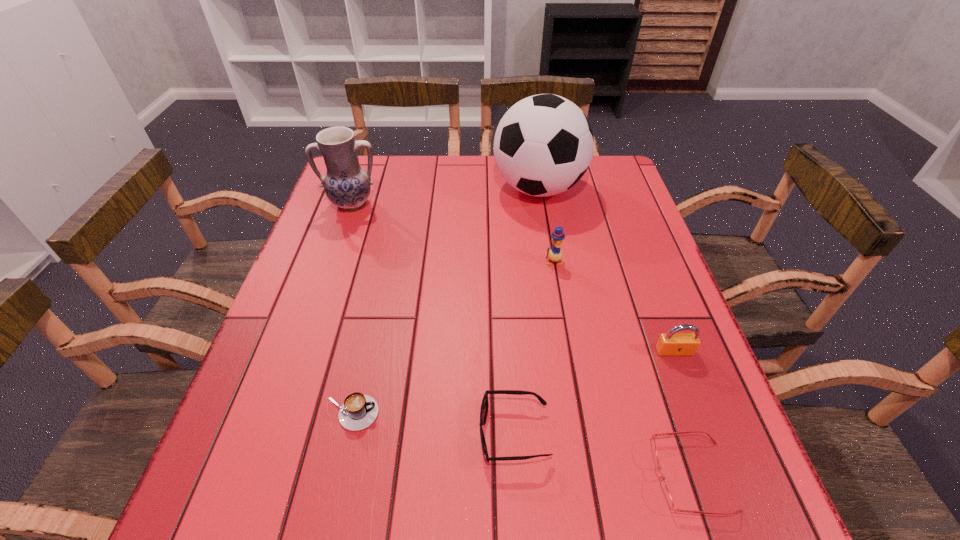
I want to click on vacant region located 0.220m on the right of the pottery, so click(x=458, y=205).

Where is `vacant space located on the face of the fifth nearest object, where the monocle is placed`? vacant space located on the face of the fifth nearest object, where the monocle is placed is located at coordinates (568, 350).

Where is `vacant space located to unlock the fourth shortest object from the front`? The width and height of the screenshot is (960, 540). vacant space located to unlock the fourth shortest object from the front is located at coordinates (739, 523).

Where is `blank space located on the front-facing side of the sunglasses`? blank space located on the front-facing side of the sunglasses is located at coordinates (350, 434).

Identify the location of vacant space located 0.340m on the front-facing side of the sunglasses. Image resolution: width=960 pixels, height=540 pixels. (288, 434).

Where is `vacant position located 0.150m on the front-facing side of the sunglasses`? The width and height of the screenshot is (960, 540). vacant position located 0.150m on the front-facing side of the sunglasses is located at coordinates (396, 434).

You are a GUI agent. You are given a task and a screenshot of the screen. Output one action in this format:
    pyautogui.click(x=<x>, y=<y>)
    Task: Click on the free space located 0.320m with the handle on the side of the cappuccino
    
    Given the screenshot: What is the action you would take?
    pyautogui.click(x=552, y=414)

At what (x,y) coordinates should I click in order to perform the action: click on vacant area situated 0.100m on the lenses of the spectacles. Please return your answer as a coordinate pair (x, y). Looking at the image, I should click on (594, 476).

I want to click on free space located on the lenses of the spectacles, so click(x=576, y=476).

Find the location of a particular element. This screenshot has height=540, width=960. free region located on the lenses of the spectacles is located at coordinates (425, 476).